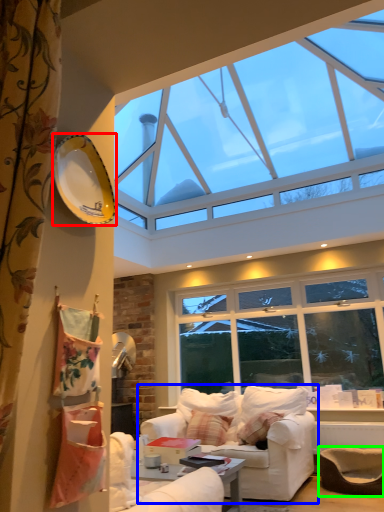
Question: Which is nearer to the plate (highlighted by a red box)? studio couch (highlighted by a blue box) or armchair (highlighted by a green box).

Choices:
 (A) studio couch
 (B) armchair

Answer: (A)